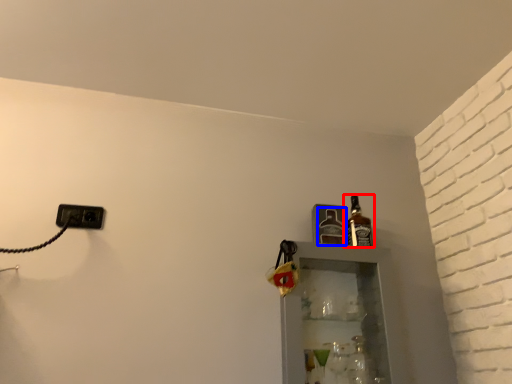
Question: Which point is further to the camera, bottle (highlighted by a red box) or bottle (highlighted by a blue box)?

Choices:
 (A) bottle
 (B) bottle

Answer: (B)